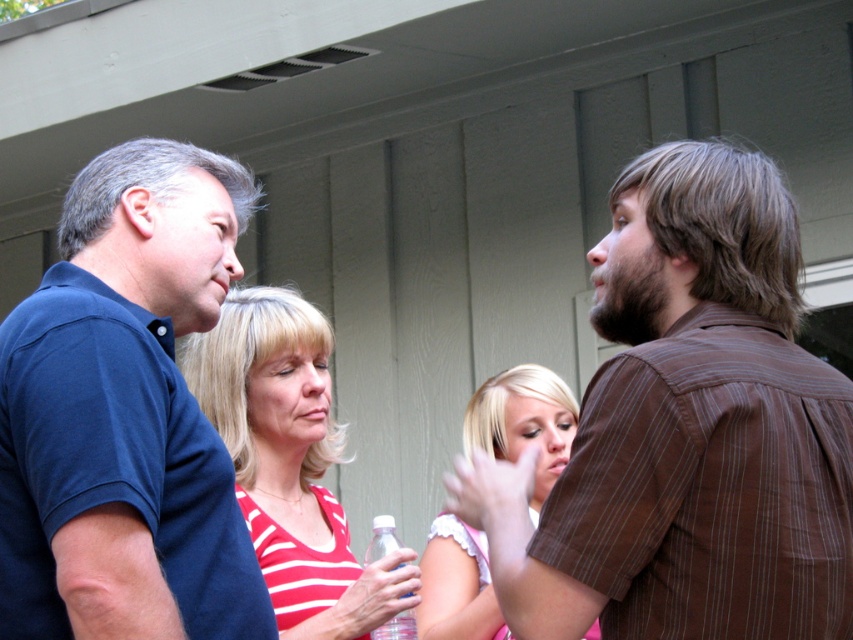
You are a photographer trying to capture a photo of the group. You notice the brown striped shirt at right and the blonde hair at center. Which one should you focus on first to ensure both are in sharp focus?

You should focus on the brown striped shirt at right first because it is closer to you than the blonde hair at center, so focusing on the closer object will help ensure both are in focus.